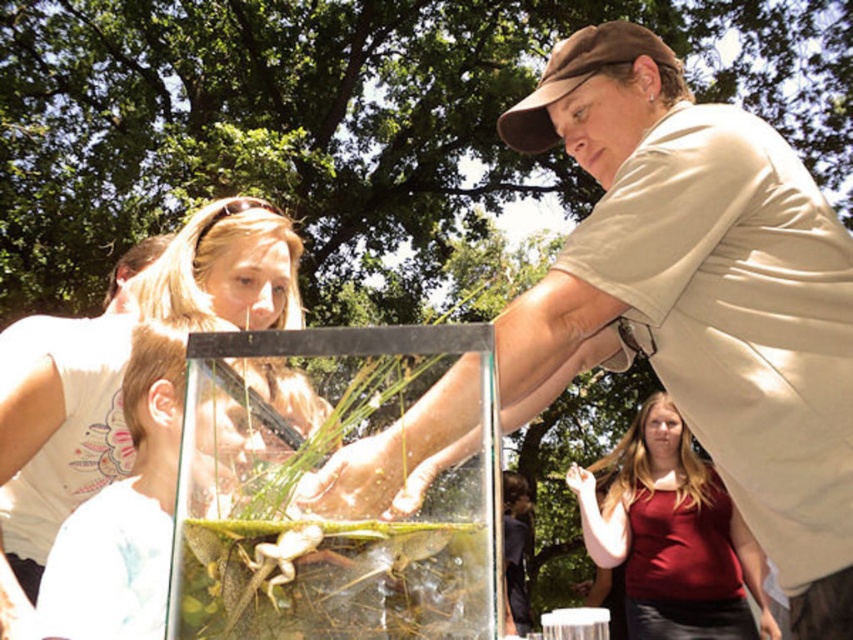
Does point (718, 323) come farther from viewer compared to point (215, 248)?

That is False.

Image resolution: width=853 pixels, height=640 pixels. Describe the element at coordinates (699, 296) in the screenshot. I see `matte beige shirt at center` at that location.

Between point (850, 518) and point (229, 321), which one is positioned behind?

The point (229, 321) is more distant.

Identify the location of matte beige shirt at center. This screenshot has width=853, height=640. (699, 296).

Who is taller, transparent glass box at center or matte red tank top at center?

matte red tank top at center

How much distance is there between transparent glass box at center and matte red tank top at center?

11.26 feet

Image resolution: width=853 pixels, height=640 pixels. In order to click on transparent glass box at center in this screenshot , I will do `click(326, 518)`.

Does matte red tank top at center have a smaller size compared to brown fabric cap at upper center?

No, matte red tank top at center is not smaller than brown fabric cap at upper center.

From the picture: Is matte red tank top at center taller than brown fabric cap at upper center?

Yes, matte red tank top at center is taller than brown fabric cap at upper center.

Where is `matte red tank top at center`? The image size is (853, 640). matte red tank top at center is located at coordinates (672, 536).